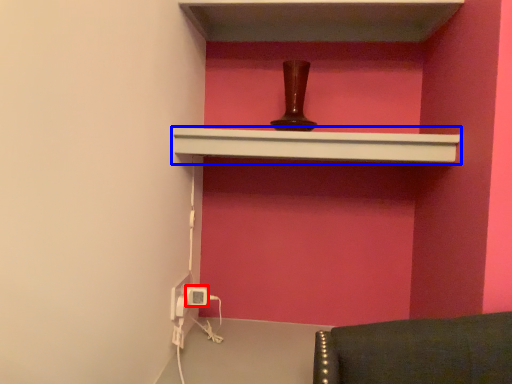
Question: Which object is further to the camera taking this photo, electric outlet (highlighted by a red box) or shelf (highlighted by a blue box)?

Choices:
 (A) electric outlet
 (B) shelf

Answer: (A)